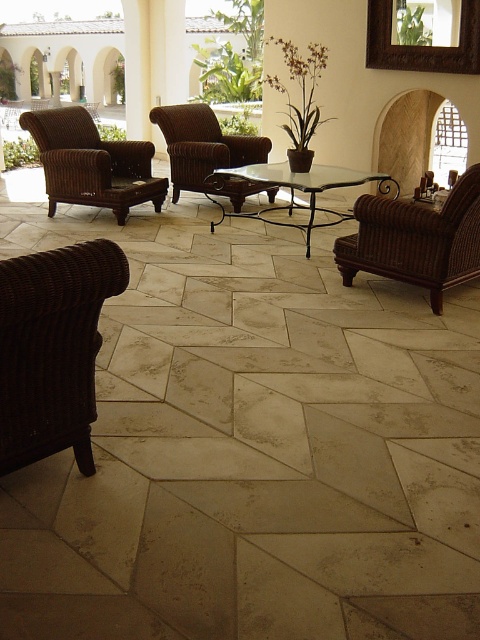
Who is taller, natural stone tile at center or brown wicker armchair at left?

natural stone tile at center

Does point (118, 509) come farther from viewer compared to point (68, 156)?

No, it is not.

The width and height of the screenshot is (480, 640). I want to click on natural stone tile at center, so click(252, 448).

The width and height of the screenshot is (480, 640). What are the coordinates of `woven brown armchair at right` in the screenshot? It's located at (416, 240).

Does woven brown armchair at right have a lesser width compared to brown wicker armchair at center?

Indeed, woven brown armchair at right has a lesser width compared to brown wicker armchair at center.

Who is more distant from viewer, (383, 224) or (190, 132)?

Positioned behind is point (190, 132).

Find the location of a particular element. The width and height of the screenshot is (480, 640). woven brown armchair at right is located at coordinates (416, 240).

Who is shorter, natural stone tile at center or dark brown woven armchair at lower left?

Standing shorter between the two is dark brown woven armchair at lower left.

Can you confirm if natural stone tile at center is wider than dark brown woven armchair at lower left?

Yes, natural stone tile at center is wider than dark brown woven armchair at lower left.

Where is `natural stone tile at center`? natural stone tile at center is located at coordinates (252, 448).